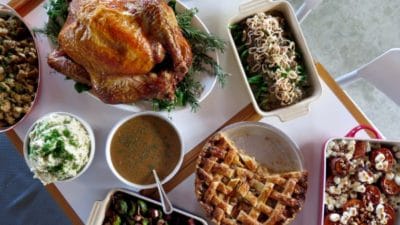
This screenshot has height=225, width=400. I want to click on casserole, so click(x=363, y=178).